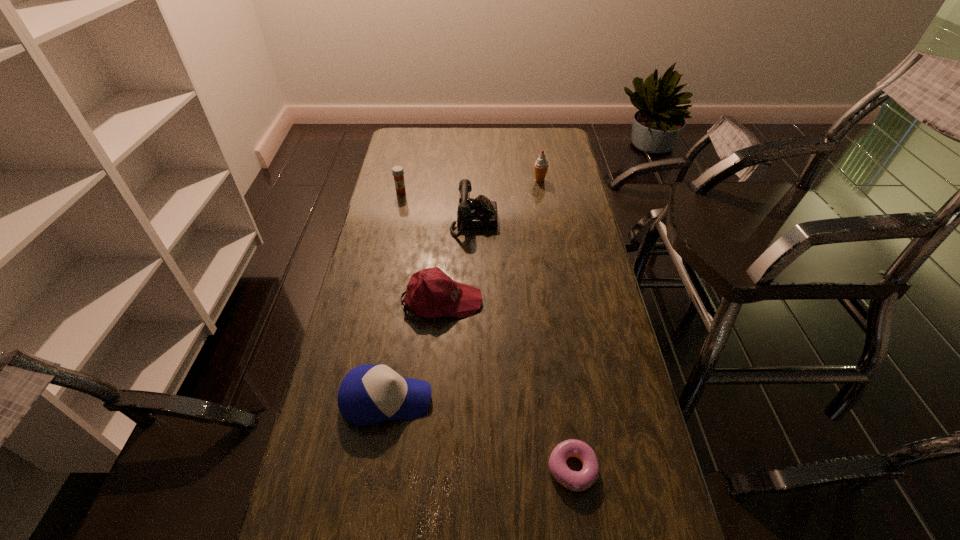
Where is `vacant space positioned 0.100m on the label side of the medicine`? The height and width of the screenshot is (540, 960). vacant space positioned 0.100m on the label side of the medicine is located at coordinates (397, 211).

Locate an element on the screen. The height and width of the screenshot is (540, 960). vacant space situated 0.190m on the front-facing side of the fifth farthest object is located at coordinates (505, 400).

You are a GUI agent. You are given a task and a screenshot of the screen. Output one action in this format:
    pyautogui.click(x=<x>, y=<y>)
    Task: Click on the vacant space located 0.250m on the left of the nearest object
    This screenshot has width=960, height=540.
    Given the screenshot: What is the action you would take?
    pyautogui.click(x=441, y=469)

Locate an element on the screen. Image resolution: width=960 pixels, height=540 pixels. medicine that is positioned at the left edge is located at coordinates (397, 171).

At what (x,y) coordinates should I click in order to perform the action: click on icecream positioned at the right edge. Please return your answer as a coordinate pair (x, y). Looking at the image, I should click on (541, 165).

At what (x,y) coordinates should I click in order to perform the action: click on doughnut present at the right edge. Please return your answer as a coordinate pair (x, y). The width and height of the screenshot is (960, 540). Looking at the image, I should click on (577, 481).

The height and width of the screenshot is (540, 960). In the image, there is a desktop. What are the coordinates of `free space at the far edge` in the screenshot? It's located at (510, 147).

Locate an element on the screen. The width and height of the screenshot is (960, 540). free region at the left edge is located at coordinates (325, 411).

The height and width of the screenshot is (540, 960). I want to click on vacant position at the right edge of the desktop, so click(x=586, y=262).

Locate an element on the screen. This screenshot has width=960, height=540. free space at the far left corner of the desktop is located at coordinates (392, 150).